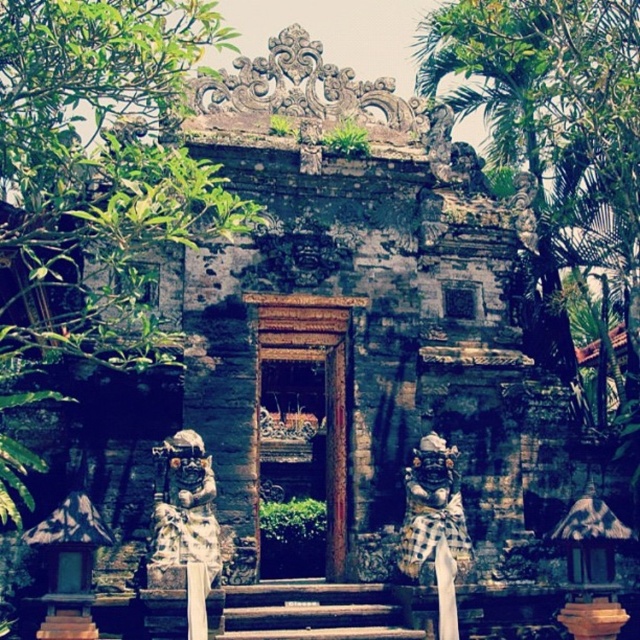
Does wooden stairs at center have a greater width compared to carved stone statue at center?

Indeed, wooden stairs at center has a greater width compared to carved stone statue at center.

Which is behind, point (332, 614) or point (412, 538)?

The point (412, 538) is more distant.

Find the location of `wooden stairs at center`. wooden stairs at center is located at coordinates pos(314,612).

Is point (292, 298) closer to camera compared to point (438, 531)?

No, (292, 298) is behind (438, 531).

Does point (340, 564) come in front of point (406, 548)?

No, (340, 564) is further to viewer.

Where is `wooden door at center`? This screenshot has height=640, width=640. wooden door at center is located at coordinates (324, 385).

Which is behind, point (276, 320) or point (352, 630)?

The point (276, 320) is behind.

Does wooden door at center come behind wooden stairs at center?

Yes.

This screenshot has width=640, height=640. Describe the element at coordinates (324, 385) in the screenshot. I see `wooden door at center` at that location.

Identify the location of wooden door at center. This screenshot has height=640, width=640. (324, 385).